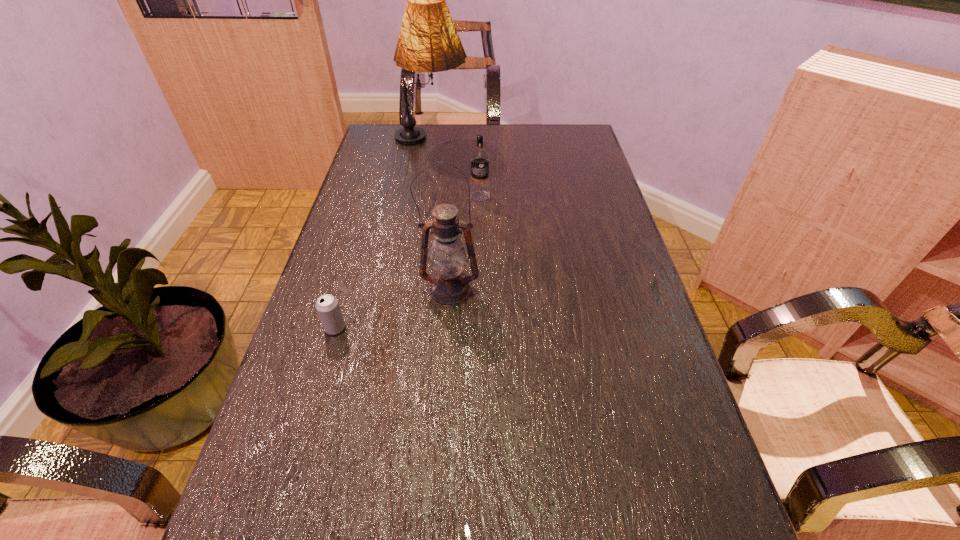
This screenshot has height=540, width=960. What are the coordinates of `vacant region located on the label of the fourth nearest object` in the screenshot? It's located at (480, 296).

Locate an element on the screen. The image size is (960, 540). vacant region located on the front of the beer can is located at coordinates (300, 447).

Locate an element on the screen. Image resolution: width=960 pixels, height=540 pixels. object that is at the far edge is located at coordinates (428, 41).

Image resolution: width=960 pixels, height=540 pixels. I want to click on lampshade that is at the left edge, so click(x=428, y=41).

At what (x,y) coordinates should I click in order to perform the action: click on beer can that is at the left edge. Please return your answer as a coordinate pair (x, y). The width and height of the screenshot is (960, 540). Looking at the image, I should click on (328, 308).

Find the location of a particular element. object located in the far left corner section of the desktop is located at coordinates (428, 41).

In order to click on vacant region at the far edge of the desktop in this screenshot , I will do click(x=534, y=138).

Image resolution: width=960 pixels, height=540 pixels. In the image, there is a desktop. Identify the location of vacant space at the left edge. (366, 174).

Find the location of `vacant space at the right edge of the desktop`. vacant space at the right edge of the desktop is located at coordinates pyautogui.click(x=583, y=294).

I want to click on blank region between the fourth shortest object and the fourth nearest object, so pos(466,244).